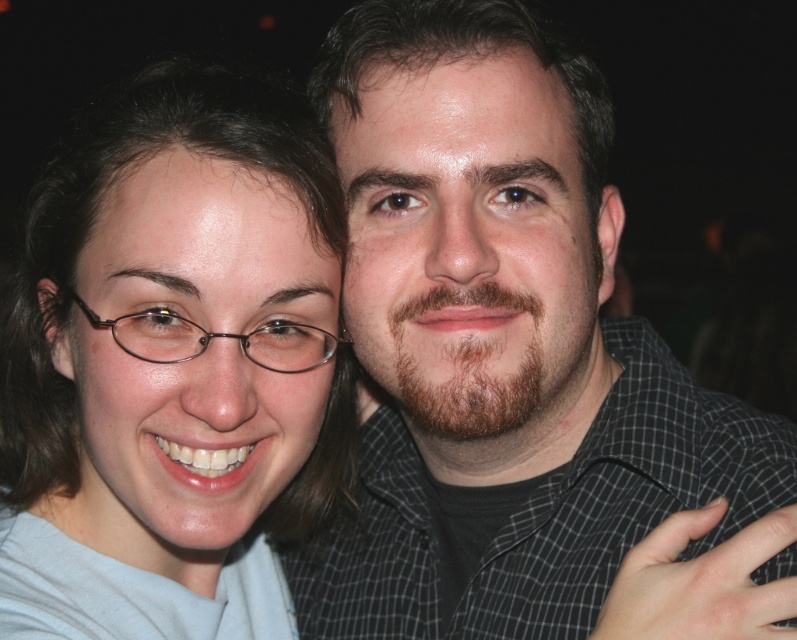
Which is below, dark gray checkered shirt at center or matte gray shirt at center?

matte gray shirt at center is below.

Does point (442, 212) come behind point (18, 292)?

No.

I want to click on dark gray checkered shirt at center, so click(x=501, y=342).